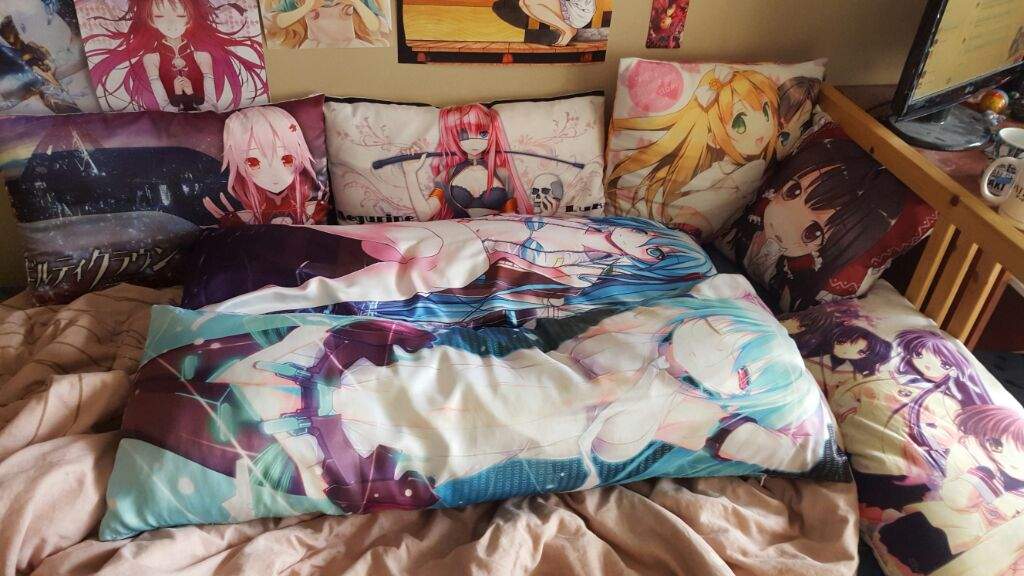
Where is `beige wall`? The width and height of the screenshot is (1024, 576). beige wall is located at coordinates (319, 69).